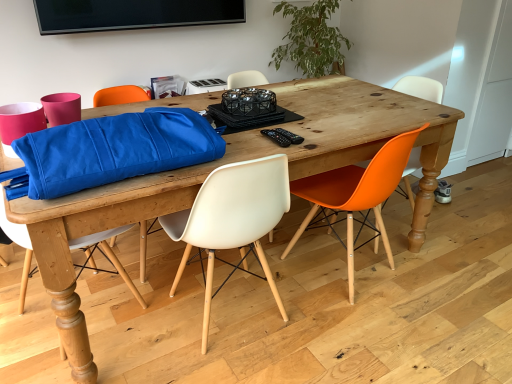
At what (x,y) coordinates should I click in order to perform the action: click on vacant area to the left of black plastic remote control at center, which is the 2th remote control in right-to-left order. Please return your answer as a coordinate pair (x, y). The image size is (512, 384). Looking at the image, I should click on (241, 138).